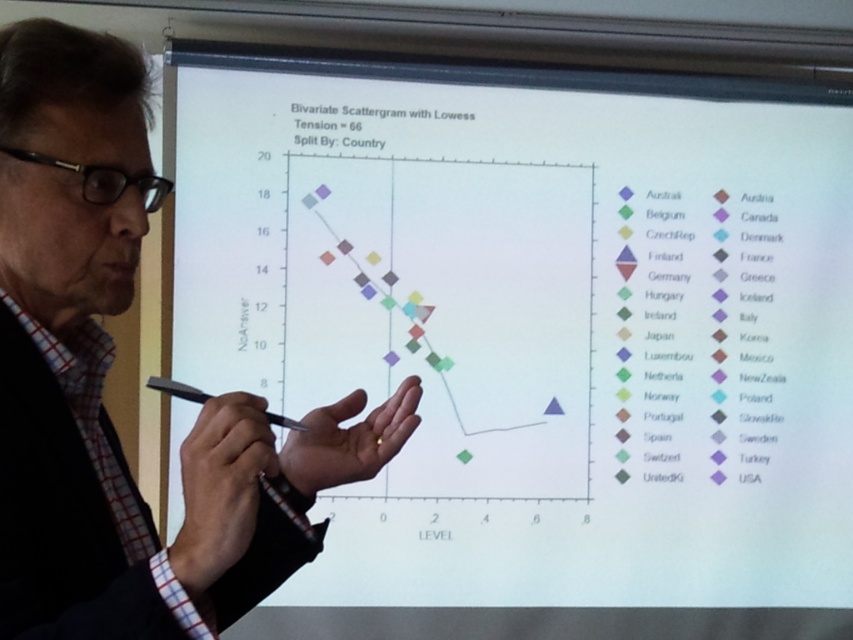
Who is more forward, (758,164) or (68,534)?

Positioned in front is point (68,534).

Can you confirm if white paper at upper center is smaller than white shirt at left?

No, white paper at upper center is not smaller than white shirt at left.

Is point (735, 280) closer to camera compared to point (103, 612)?

That is False.

Identify the location of white paper at upper center. The image size is (853, 640). [x=535, y=317].